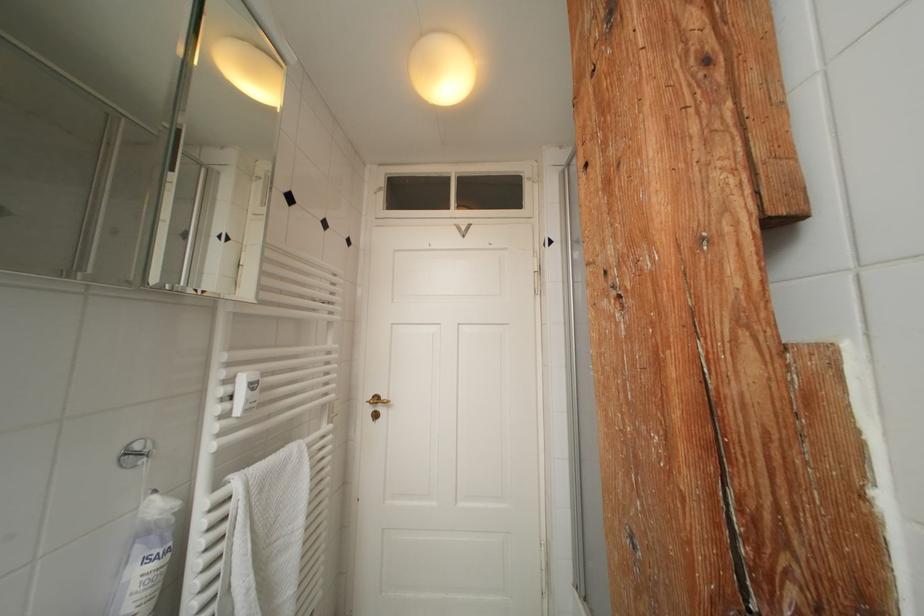
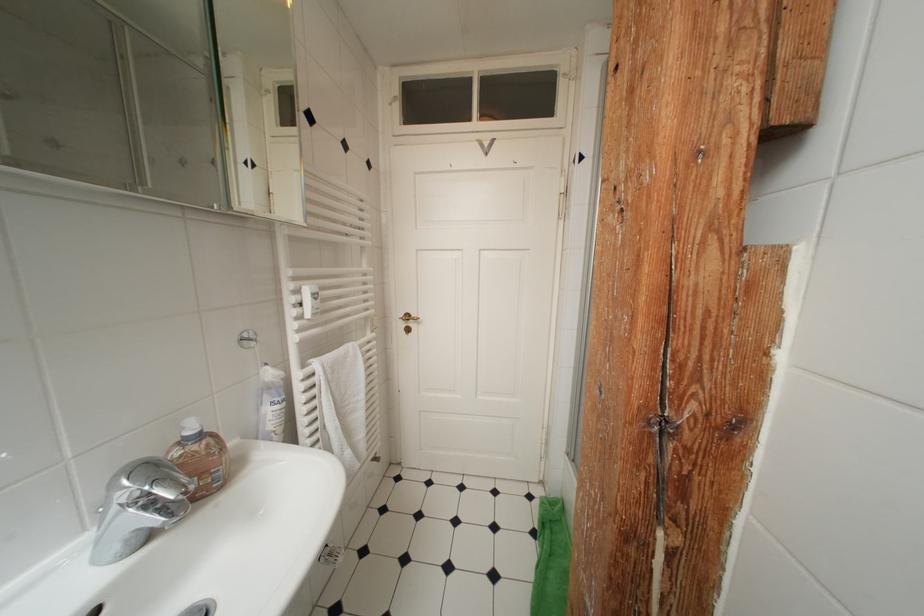
In the second image, find the point that corresponds to point (383, 402) in the first image.

(415, 320)